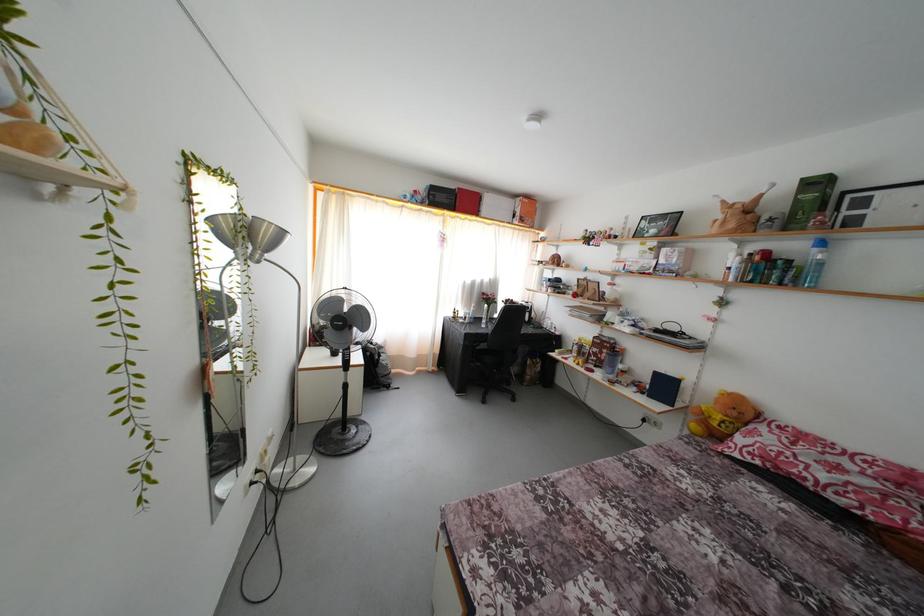
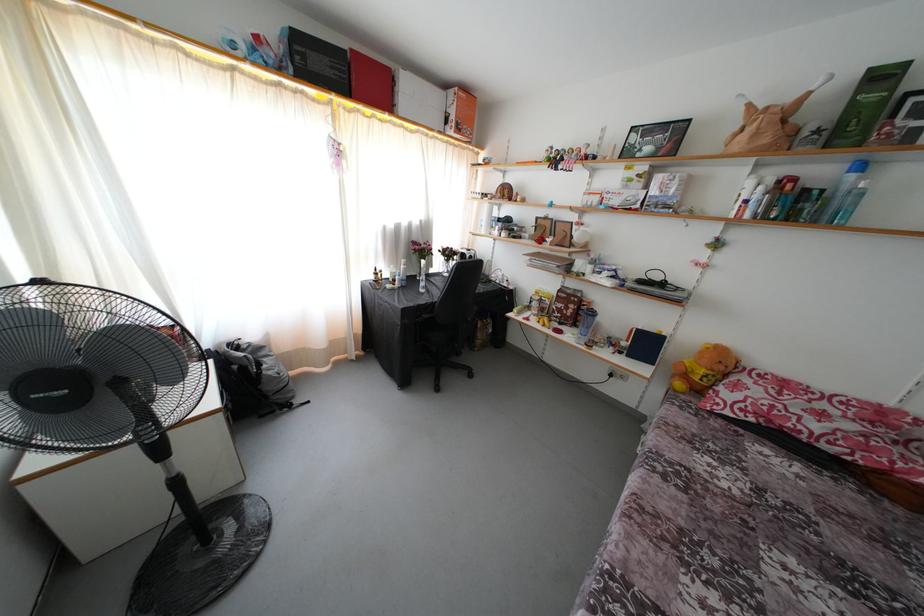
Find the pixel in the second image that matches the point at 738,419 in the first image.

(726, 373)